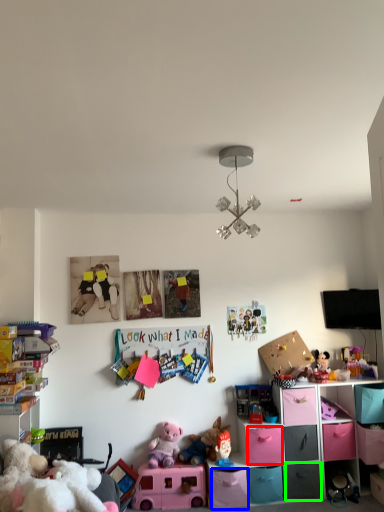
Question: Based on their relative distances, which object is nearer to drawer (highlighted by a red box)? Choose from drawer (highlighted by a blue box) and drawer (highlighted by a green box).

Choices:
 (A) drawer
 (B) drawer

Answer: (A)